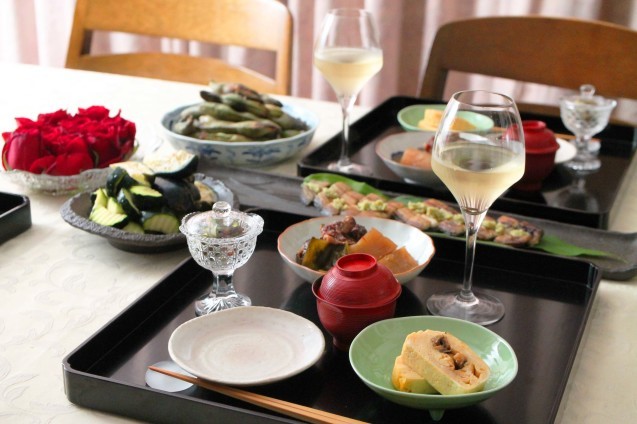
This screenshot has width=637, height=424. I want to click on chair backs, so click(x=560, y=56), click(x=248, y=21).